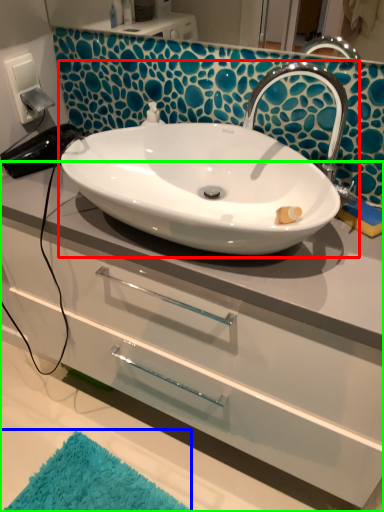
Question: Which is nearer to the sink (highlighted by a red box)? bath mat (highlighted by a blue box) or bathroom cabinet (highlighted by a green box).

Choices:
 (A) bath mat
 (B) bathroom cabinet

Answer: (B)